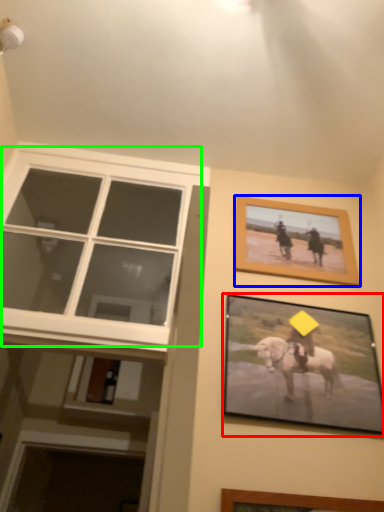
Question: Which object is the farthest from picture frame (highlighted by a red box)? Choose among these: picture frame (highlighted by a blue box) or window (highlighted by a green box).

Choices:
 (A) picture frame
 (B) window

Answer: (B)